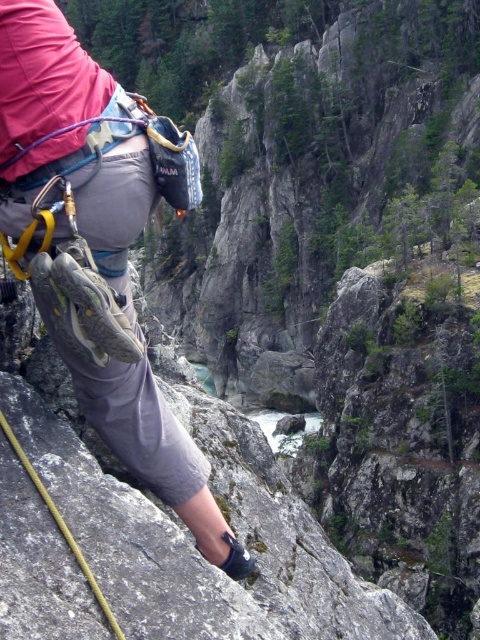
Does matte gray climbing shoe at center come behind yellow nylon rope at lower left?

Yes.

Does point (135, 124) lie in front of point (13, 436)?

No, (135, 124) is further to viewer.

Image resolution: width=480 pixels, height=640 pixels. I want to click on matte gray climbing shoe at center, so click(99, 244).